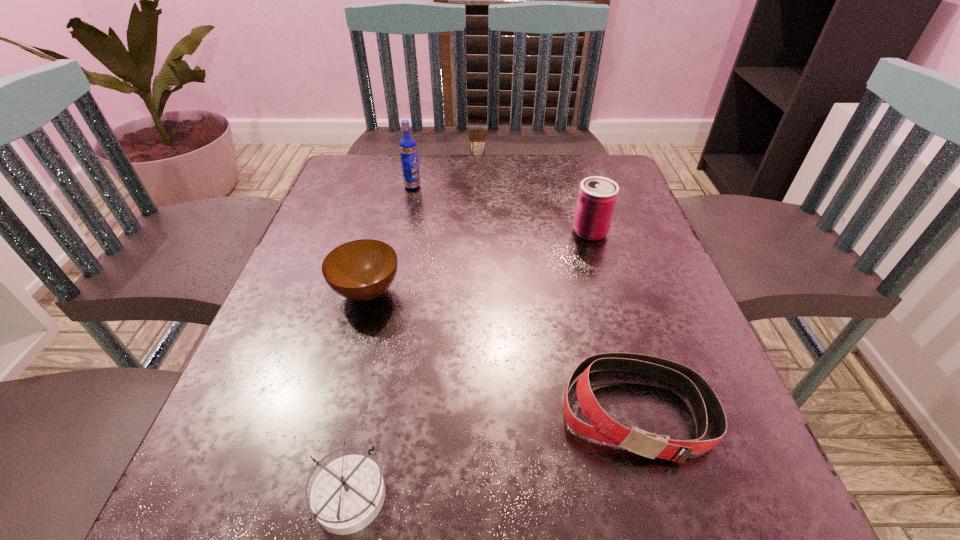
Where is `the farthest object`? This screenshot has height=540, width=960. the farthest object is located at coordinates (408, 149).

Locate an element on the screen. vodka is located at coordinates (408, 149).

Locate an element on the screen. This screenshot has width=960, height=540. the second farthest object is located at coordinates (597, 196).

Find the location of a particular element. Image resolution: width=960 pixels, height=540 pixels. the fourth shortest object is located at coordinates (597, 196).

Find the location of a particular element. The image size is (960, 540). the third farthest object is located at coordinates (359, 270).

Identify the location of dog collar. (603, 428).

Find the location of a particular element. This screenshot has width=960, height=540. compass is located at coordinates (347, 495).

Locate an element on the screen. vacant region located 0.070m on the left of the vodka is located at coordinates (377, 186).

The height and width of the screenshot is (540, 960). In order to click on blank space located on the left of the fourth shortest object in this screenshot , I will do `click(439, 232)`.

The height and width of the screenshot is (540, 960). Find the location of `vacant region located 0.340m on the back of the third nearest object`. vacant region located 0.340m on the back of the third nearest object is located at coordinates point(396,182).